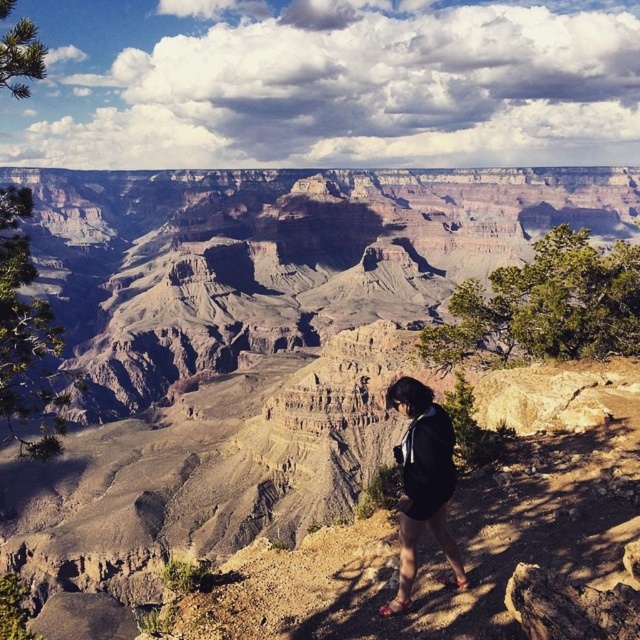
Question: Which of the following is the farthest from the observer?

Choices:
 (A) (312, 358)
 (B) (417, 435)

Answer: (A)

Question: Which point appears farthest from the camera in this image?

Choices:
 (A) (273, 179)
 (B) (433, 509)

Answer: (A)

Question: Is brown rocky canyon at center wider than black fabric shorts at lower right?

Choices:
 (A) yes
 (B) no

Answer: (A)

Question: Is brown rocky canyon at center bigger than black fabric shorts at lower right?

Choices:
 (A) no
 (B) yes

Answer: (B)

Question: Can you confirm if brown rocky canyon at center is positioned above black fabric shorts at lower right?

Choices:
 (A) no
 (B) yes

Answer: (B)